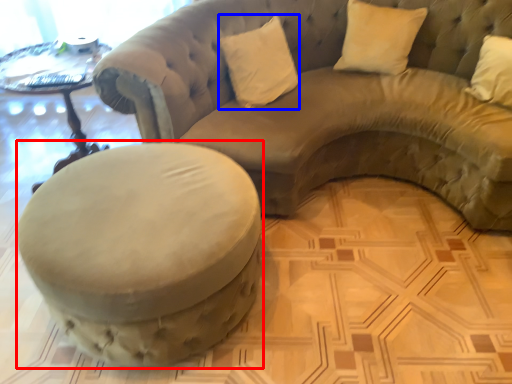
Question: Which of the following is the closest to the observer, swivel chair (highlighted by a red box) or pillow (highlighted by a blue box)?

Choices:
 (A) swivel chair
 (B) pillow

Answer: (A)